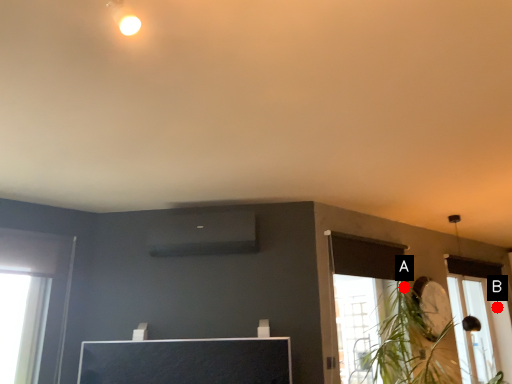
Question: Two points are circled on the image, labeled by A and B beside each circle. Which point appears closest to the camera in this image?

Choices:
 (A) A is closer
 (B) B is closer

Answer: (A)